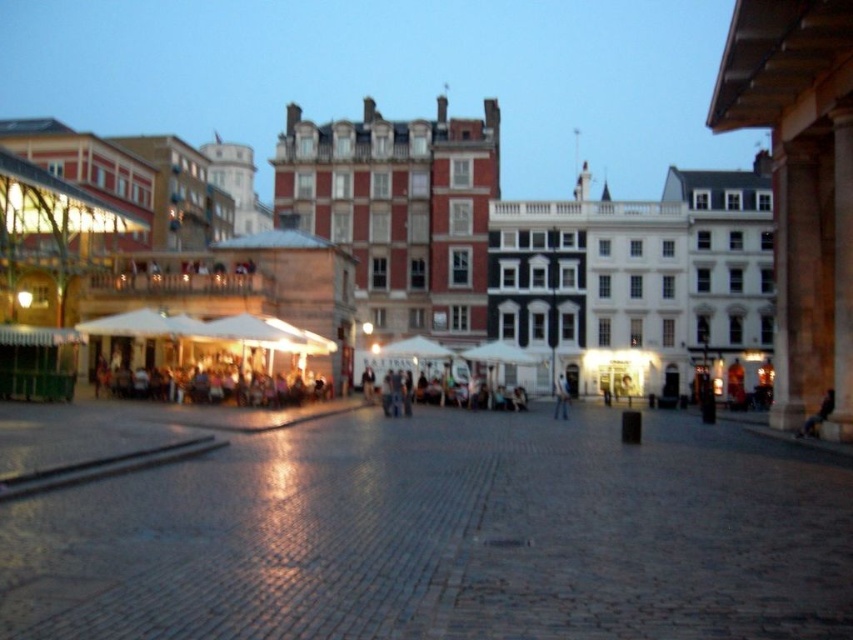
Does point (624, 220) come behind point (561, 378)?

That is True.

Does white matte building at center come in front of light blue jeans at center?

Yes, it is.

I want to click on white matte building at center, so click(537, 252).